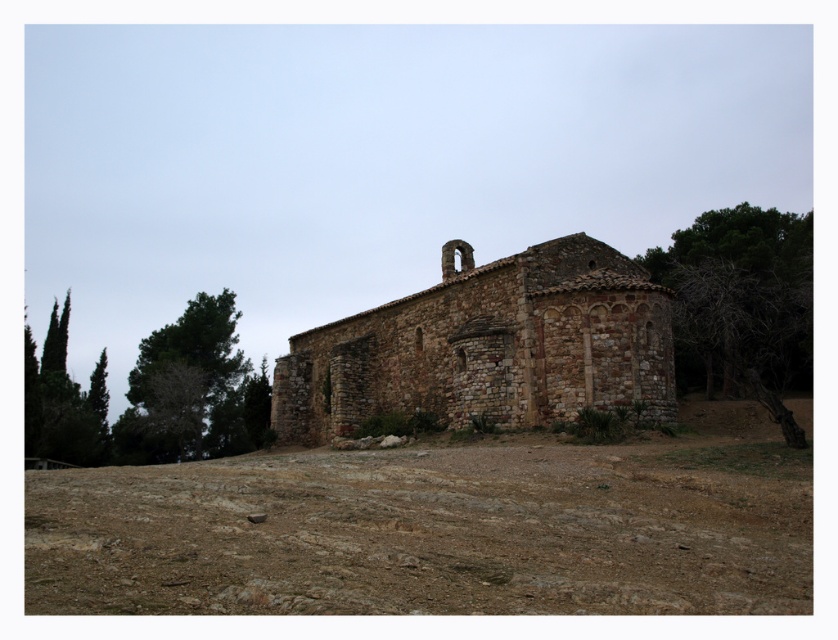
Question: Which object is closer to the camera taking this photo?

Choices:
 (A) green leafy tree at lower left
 (B) brown gravelly dirt at lower center
 (C) brown stone church at center

Answer: (B)

Question: Can you confirm if brown stone church at center is smaller than green leafy tree at left?

Choices:
 (A) yes
 (B) no

Answer: (A)

Question: Based on their relative distances, which object is nearer to the green leafy tree at left?

Choices:
 (A) brown stone church at center
 (B) green leafy tree at lower left

Answer: (B)

Question: Is brown stone church at center smaller than green leafy tree at left?

Choices:
 (A) yes
 (B) no

Answer: (A)

Question: Does brown stone church at center appear on the left side of green leafy tree at lower left?

Choices:
 (A) no
 (B) yes

Answer: (A)

Question: Which point appears farthest from the camera in this image?

Choices:
 (A) (591, 470)
 (B) (156, 352)
 (C) (347, 394)
 (D) (779, 228)

Answer: (B)